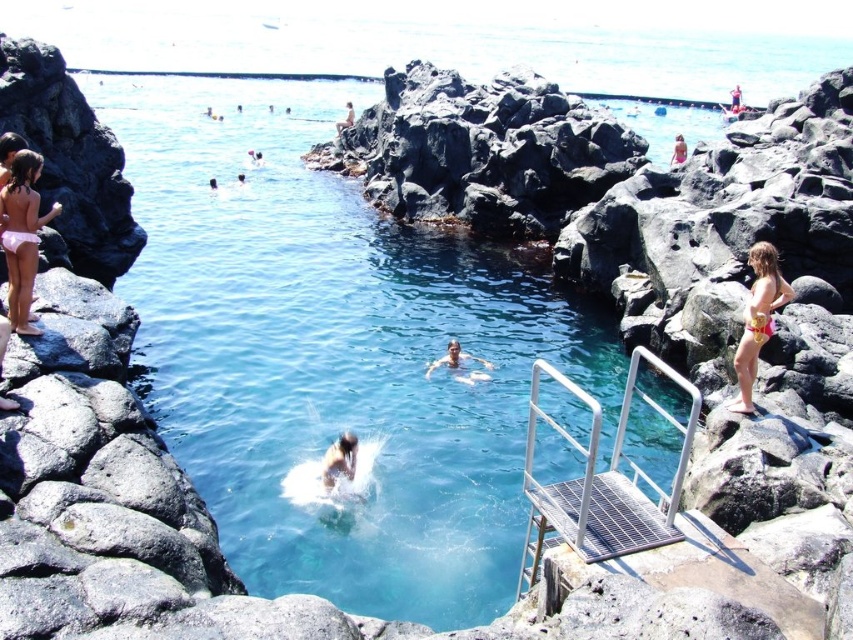
Question: Does silver metallic ladder at right lie behind smooth brown hair at center?

Choices:
 (A) yes
 (B) no

Answer: (B)

Question: Does clear blue water at center appear over pink fabric bikini at left?

Choices:
 (A) yes
 (B) no

Answer: (A)

Question: Among these objects, which one is nearest to the camera?

Choices:
 (A) smooth brown hair at center
 (B) clear blue water at center
 (C) transparent plastic pool at upper center
 (D) smooth skin person at center

Answer: (B)

Question: Where is silver metallic ladder at right located in relation to gold metallic bikini at right in the image?

Choices:
 (A) below
 (B) above

Answer: (A)

Question: Which point is closer to the camera?

Choices:
 (A) (518, 369)
 (B) (457, 380)

Answer: (B)

Question: Among these points, which one is farthest from the camera?

Choices:
 (A) (753, 248)
 (B) (476, 360)
 (C) (621, 99)

Answer: (C)